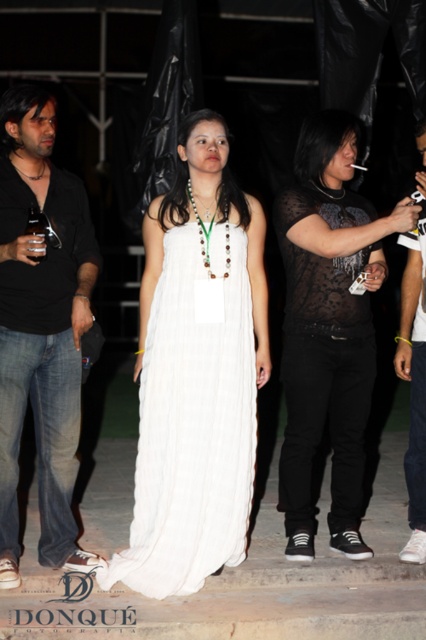
You are standing at the point labeled point (420,264) and want to move towards the point labeled point (54,417). Which direction should you move to get closer to your destination?

You should move downward and to the right because point (54,417) is closer to the camera than point (420,264), meaning it is located lower and to the right in the image.

Looking at this image, you are standing in the center of the image. Which direction should you move to get closer to the black matte shirt at left?

Since the black matte shirt at left is located at point (40, 326), moving to the left from the center would bring you closer to it.

You are standing at the center of the image and see the point marked at coordinates (328,328). What object is located at that point?

The point at coordinates (328,328) marks the location of the matte black dress at center.